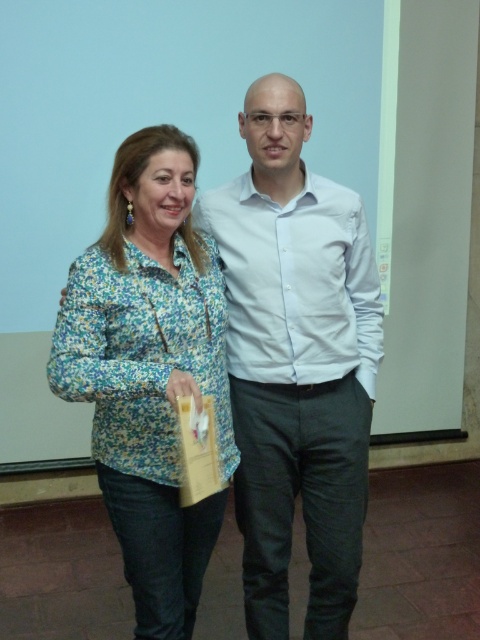
You are a photographer setting up for a group photo. You have two subjects wearing the white smooth shirt at center and the floral fabric jacket at left. The minimum distance required between subjects for your camera to focus clearly is 10 inches. Can both subjects be in focus if they stand exactly as shown?

The distance between the white smooth shirt at center and the floral fabric jacket at left is 10.01 inches, which is just over the 10 inch minimum requirement. Therefore, both subjects can be in focus if they stand exactly as shown.

You are organizing a charity event and need to display two garments on a mannequin. The garments are the white smooth shirt at center and the floral fabric jacket at left. Which garment should you place on the upper part of the mannequin to ensure it looks balanced?

The white smooth shirt at center is bigger than the floral fabric jacket at left, so placing the white smooth shirt at center on the upper part of the mannequin would create a balanced look by using its larger size to anchor the display.